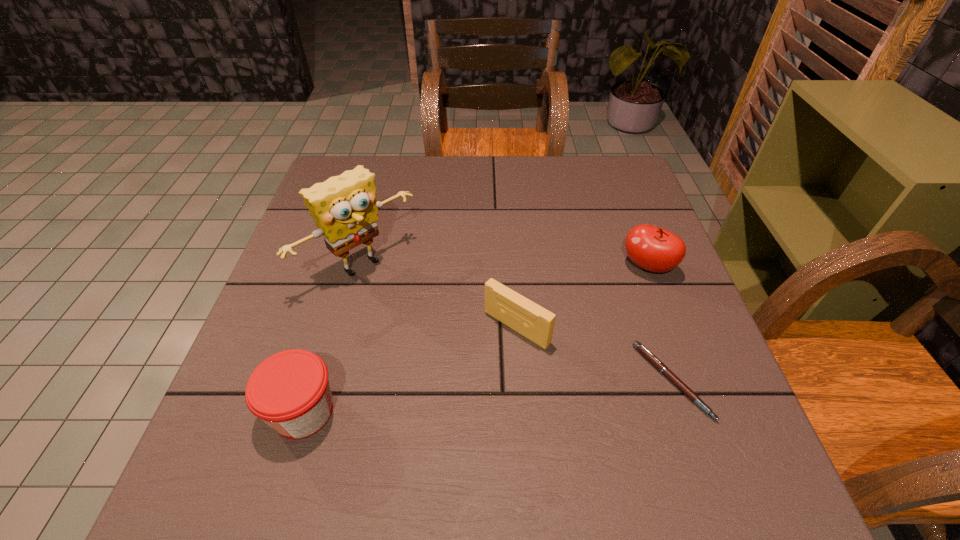
Identify the location of empty space between the third object from left to right and the jam. (410, 369).

Locate an element on the screen. The height and width of the screenshot is (540, 960). empty location between the third shortest object and the fourth shortest object is located at coordinates (475, 339).

The height and width of the screenshot is (540, 960). In order to click on empty location between the fourth tallest object and the apple in this screenshot , I will do `click(582, 297)`.

Find the location of `vacant space that is in between the apple and the sponge`. vacant space that is in between the apple and the sponge is located at coordinates (504, 266).

The height and width of the screenshot is (540, 960). What are the coordinates of `free space between the apple and the jam` in the screenshot? It's located at (475, 339).

The width and height of the screenshot is (960, 540). I want to click on vacant space in between the second shortest object and the sponge, so (439, 296).

Where is `vacant space in between the tallest object and the third object from left to right`? The width and height of the screenshot is (960, 540). vacant space in between the tallest object and the third object from left to right is located at coordinates (439, 296).

Find the location of a particular element. free space between the third tallest object and the second shortest object is located at coordinates (410, 369).

Locate an element on the screen. This screenshot has height=540, width=960. free spot between the tallest object and the third tallest object is located at coordinates click(332, 339).

Locate an element on the screen. Image resolution: width=960 pixels, height=540 pixels. the closest object to the tallest object is located at coordinates (536, 323).